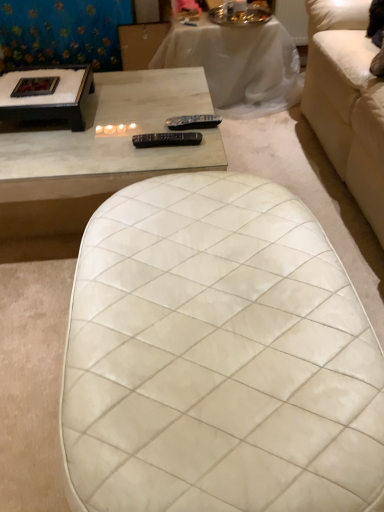
Question: Can you confirm if blue floral fabric at upper left is positioned to the left of black wood coffee table at upper left, which ranks as the first coffee table in left-to-right order?

Choices:
 (A) no
 (B) yes

Answer: (B)

Question: Is blue floral fabric at upper left next to black wood coffee table at upper left, which ranks as the first coffee table in left-to-right order, and touching it?

Choices:
 (A) yes
 (B) no

Answer: (B)

Question: From the image's perspective, is blue floral fabric at upper left on top of black wood coffee table at upper left, which ranks as the second coffee table in right-to-left order?

Choices:
 (A) no
 (B) yes

Answer: (B)

Question: Is blue floral fabric at upper left looking in the opposite direction of black wood coffee table at upper left, which ranks as the second coffee table in right-to-left order?

Choices:
 (A) yes
 (B) no

Answer: (B)

Question: Is blue floral fabric at upper left completely or partially outside of black wood coffee table at upper left, which ranks as the first coffee table in left-to-right order?

Choices:
 (A) no
 (B) yes

Answer: (B)

Question: Does blue floral fabric at upper left have a greater width compared to black wood coffee table at upper left, which ranks as the first coffee table in left-to-right order?

Choices:
 (A) yes
 (B) no

Answer: (B)

Question: Are white marble table at upper center, the 1th table viewed from the top, and black plastic remote at center, the 2th remote in the front-to-back sequence, making contact?

Choices:
 (A) yes
 (B) no

Answer: (B)

Question: Is white marble table at upper center, which is the 2th table from front to back, shorter than black plastic remote at center, which appears as the 1th remote when viewed from the back?

Choices:
 (A) yes
 (B) no

Answer: (B)

Question: Is white marble table at upper center, which is the 2th table from front to back, looking in the opposite direction of black plastic remote at center, the 2th remote in the front-to-back sequence?

Choices:
 (A) yes
 (B) no

Answer: (B)

Question: Can you confirm if white marble table at upper center, which is counted as the first table, starting from the back, is thinner than black plastic remote at center, the 2th remote in the front-to-back sequence?

Choices:
 (A) no
 (B) yes

Answer: (A)

Question: From the image's perspective, is white marble table at upper center, which appears as the second table when ordered from the bottom, located above black plastic remote at center, which ranks as the first remote in top-to-bottom order?

Choices:
 (A) no
 (B) yes

Answer: (B)

Question: From a real-world perspective, is white marble table at upper center, which is the 2th table from front to back, on top of black plastic remote at center, which ranks as the first remote in top-to-bottom order?

Choices:
 (A) no
 (B) yes

Answer: (A)

Question: Is white quilted ottoman at center, which appears as the 2th table when viewed from the back, positioned in front of blue floral fabric at upper left?

Choices:
 (A) yes
 (B) no

Answer: (A)